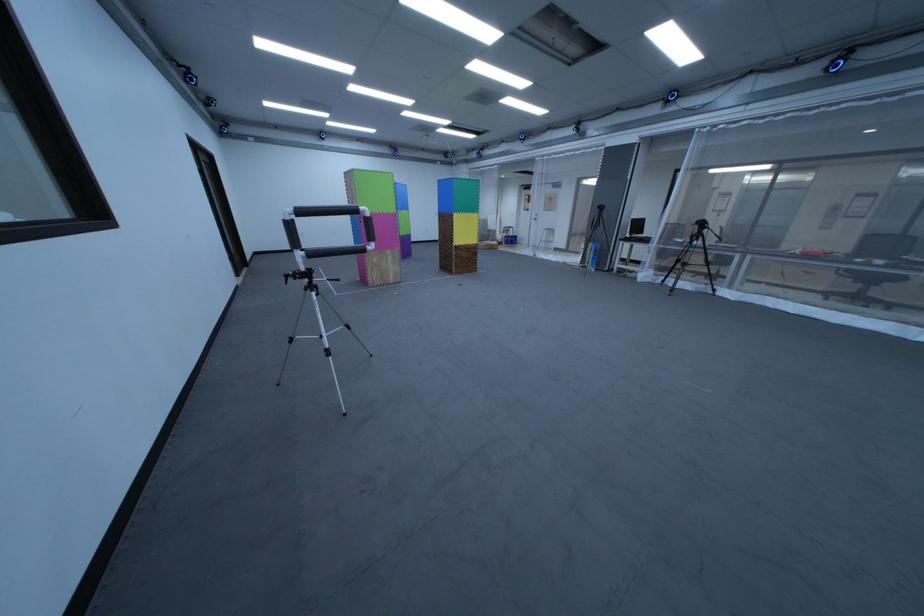
Find where to push the pink foam block. Please return your answer as a coordinate pair (x, y).

(378, 230)